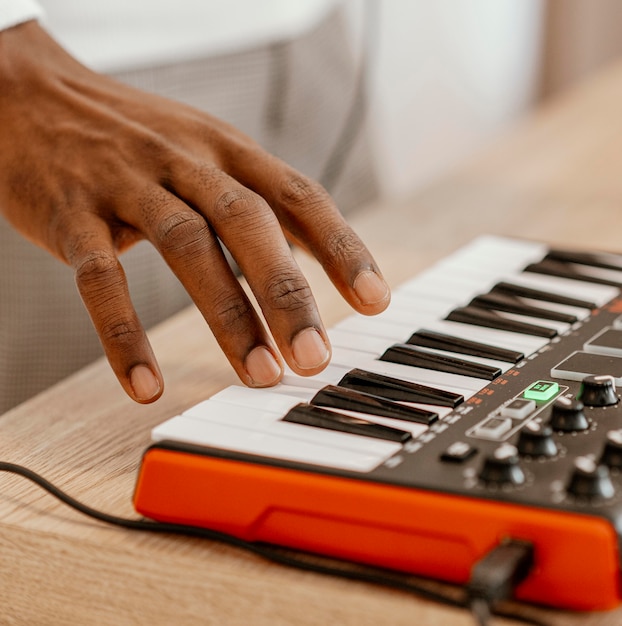
At what (x,y) coordinates should I click in order to perform the action: click on black key on keyboard. Please return your answer as a coordinate pair (x, y). This screenshot has width=622, height=626. Looking at the image, I should click on (305, 421), (341, 402), (369, 384), (420, 357), (441, 347), (471, 317), (490, 300), (517, 290), (552, 269), (569, 259).